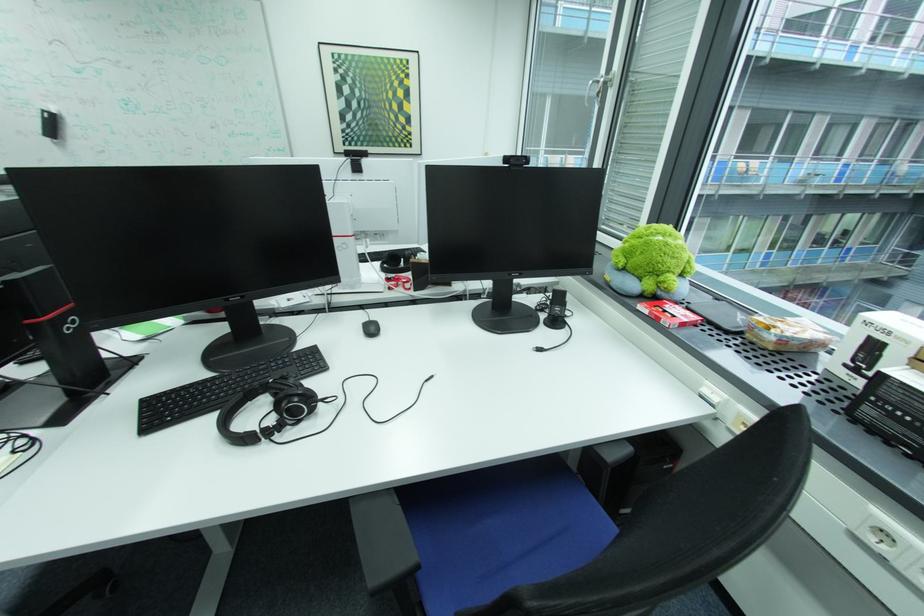
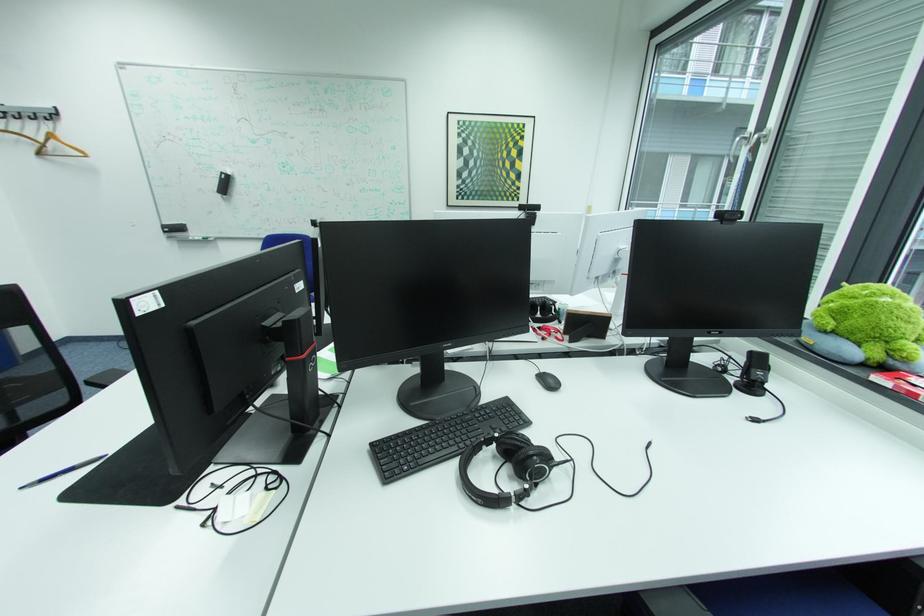
Where in the second image is the point corresponding to point 575,323 from the first image?

(774, 390)